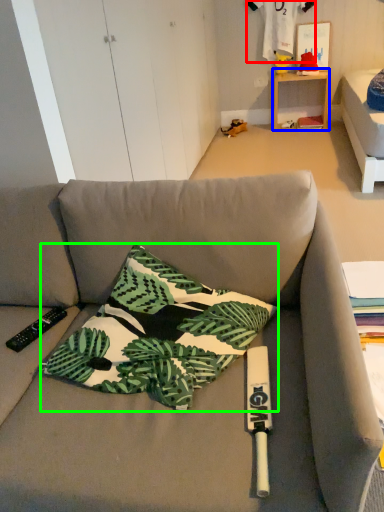
Question: Which object is the farthest from fabric (highlighted by a red box)? Choose among these: table (highlighted by a blue box) or pillow (highlighted by a green box).

Choices:
 (A) table
 (B) pillow

Answer: (B)